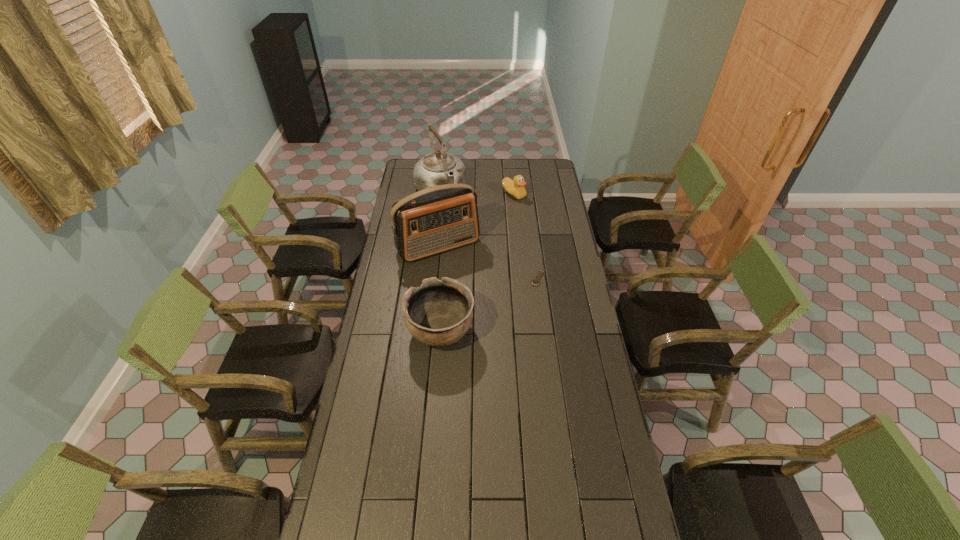
The image size is (960, 540). Find the location of `radio receiver present at the left edge`. radio receiver present at the left edge is located at coordinates (436, 219).

This screenshot has height=540, width=960. In order to click on kettle that is at the left edge in this screenshot , I will do `click(437, 168)`.

Locate an element on the screen. Image resolution: width=960 pixels, height=540 pixels. object present at the right edge is located at coordinates (535, 282).

Locate an element on the screen. This screenshot has height=540, width=960. object located at the far left corner is located at coordinates (437, 168).

Image resolution: width=960 pixels, height=540 pixels. What are the coordinates of `vacant space at the near edge of the desktop` in the screenshot? It's located at (509, 501).

You are a GUI agent. You are given a task and a screenshot of the screen. Output one action in this format:
    pyautogui.click(x=<x>, y=<y>)
    Task: Click on the free space at the left edge of the desktop
    
    Given the screenshot: What is the action you would take?
    pyautogui.click(x=396, y=299)

Where is `free spot at the right edge of the desktop`? This screenshot has width=960, height=540. free spot at the right edge of the desktop is located at coordinates (554, 219).

At what (x,y) coordinates should I click in order to perform the action: click on free space at the near right corner of the desktop. Please return your answer as a coordinate pair (x, y). Image resolution: width=960 pixels, height=540 pixels. Looking at the image, I should click on (596, 510).

At what (x,y) coordinates should I click in order to perform the action: click on free space that is in between the fourth tallest object and the nearest object. Please return your answer as a coordinate pair (x, y). This screenshot has width=960, height=540. Looking at the image, I should click on (477, 263).

Find the location of `free space that is in between the kettle and the shortest object`. free space that is in between the kettle and the shortest object is located at coordinates (490, 235).